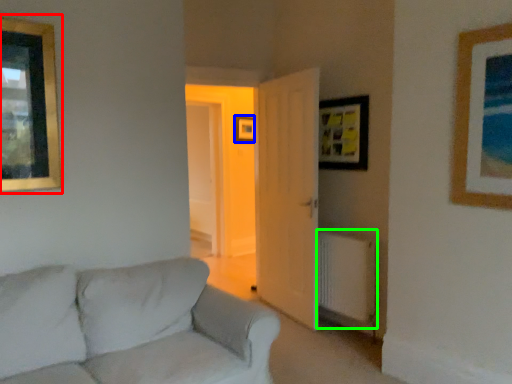
Question: Which is nearer to the picture frame (highlighted by a red box)? picture frame (highlighted by a blue box) or radiator (highlighted by a green box).

Choices:
 (A) picture frame
 (B) radiator

Answer: (B)